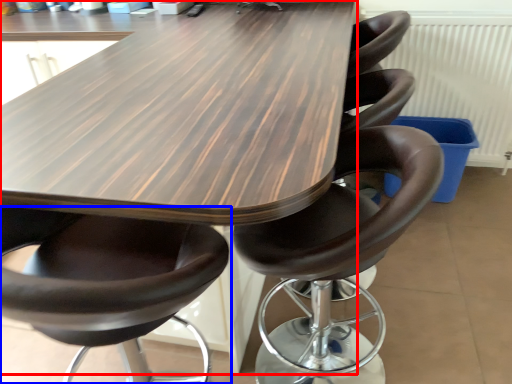
Question: Which object is further to the camera taking this photo, table (highlighted by a red box) or chair (highlighted by a blue box)?

Choices:
 (A) table
 (B) chair

Answer: (A)